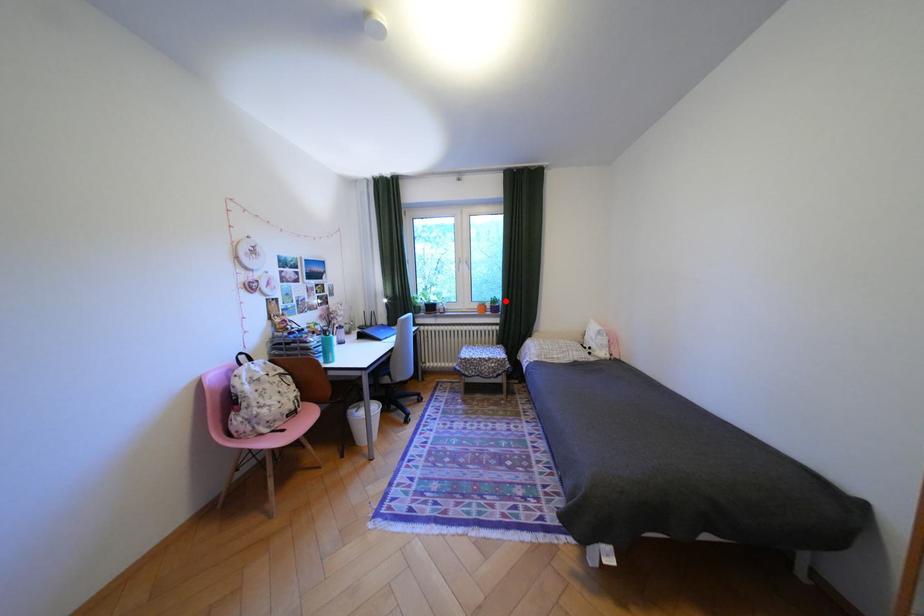
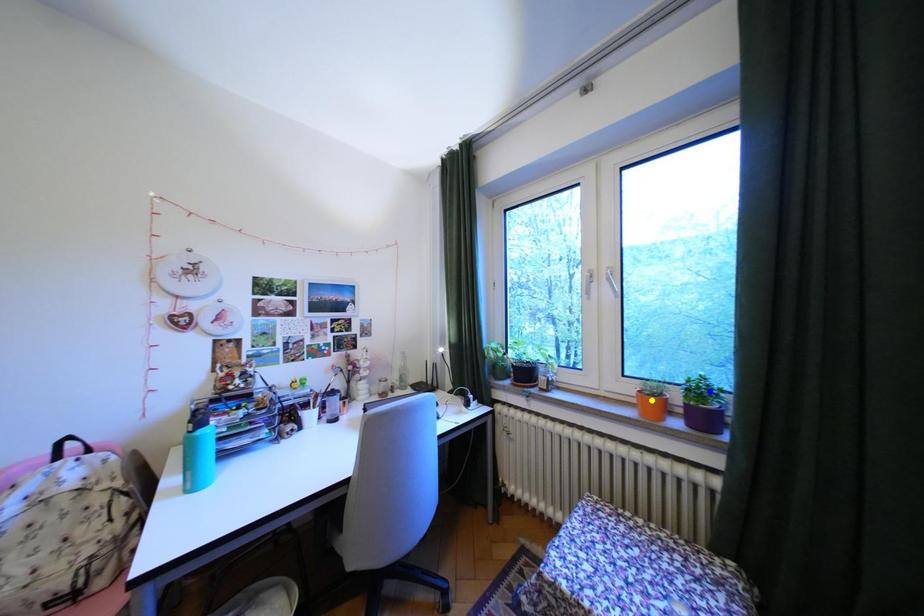
Question: I am providing you with two images of the same scene from different viewpoints. A red point is marked on the first image. You are given multiple points on the second image. Which point in image 2 is actually the same real-world point as the red point in image 1?

Choices:
 (A) green point
 (B) yellow point
 (C) blue point

Answer: (C)